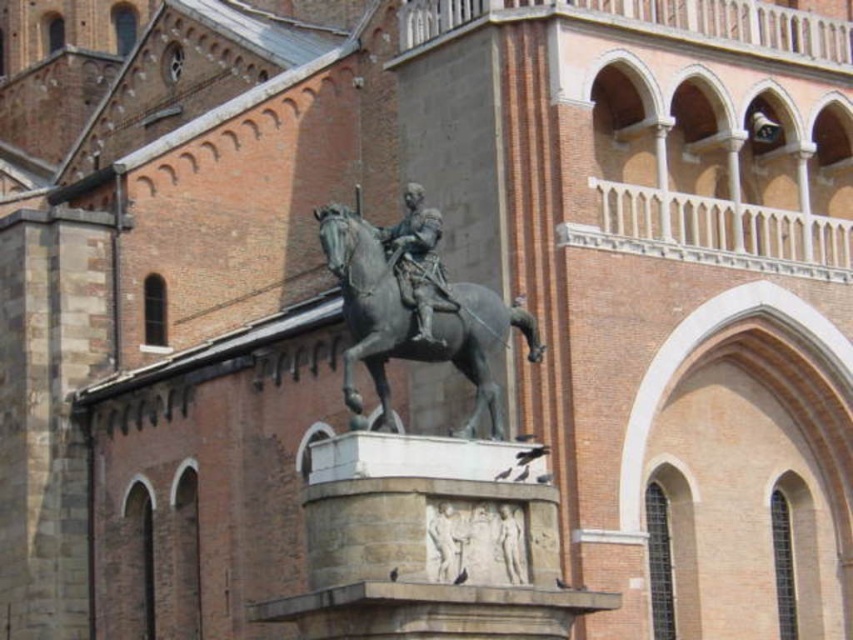
You are an art conservator examining the bronze statue of horse at center and the polished bronze statue at center. Which one has a greater width?

The bronze statue of horse at center has a greater width than the polished bronze statue at center according to the description.

You are a tour guide explaining the layout of the square to a visitor. Pointing to the bronze statue of horse at center, you want to indicate its exact location using coordinates. What coordinates would you mention?

The bronze statue of horse at center is located at coordinates point (415,321).

You are an art student analyzing the composition of the statue. You notice two parts labeled as the bronze statue of horse at center and the polished bronze statue at center. Which part is closer to the viewer?

The bronze statue of horse at center is closer to the viewer than the polished bronze statue at center.